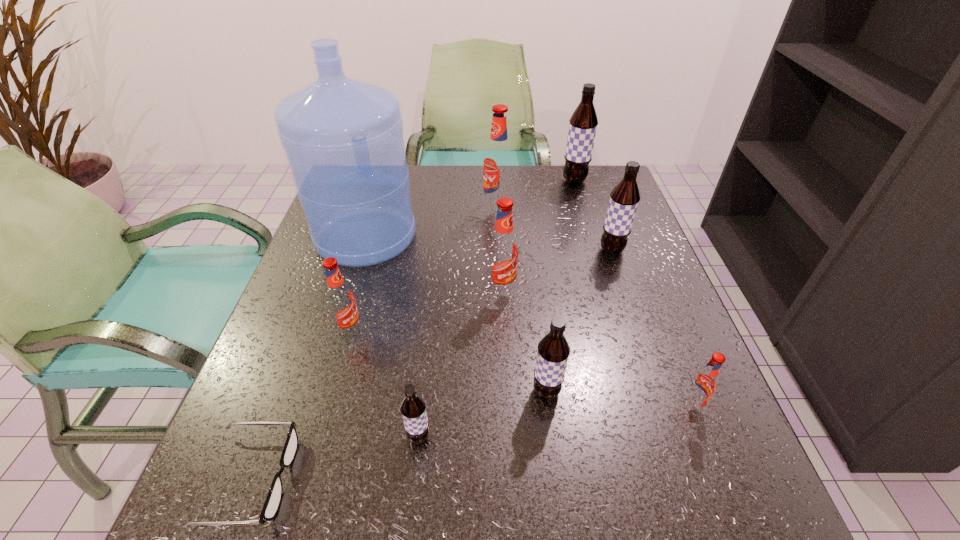
I want to click on free space located on the right of the nearest root beer, so click(x=638, y=437).

Locate an element on the screen. The image size is (960, 540). free space located on the front-facing side of the black spectacles is located at coordinates (378, 478).

Locate an element on the screen. The width and height of the screenshot is (960, 540). water jug situated at the far edge is located at coordinates (343, 138).

Locate an element on the screen. This screenshot has height=540, width=960. object situated at the near edge is located at coordinates (273, 500).

Where is `water jug that is at the left edge`? water jug that is at the left edge is located at coordinates (343, 138).

Identify the location of root beer that is at the left edge. (340, 299).

Locate an element on the screen. This screenshot has height=540, width=960. spectacles at the left edge is located at coordinates (273, 500).

Where is `object present at the far left corner`? object present at the far left corner is located at coordinates (343, 138).

Where is `object that is at the near left corner`? object that is at the near left corner is located at coordinates (273, 500).

Where is `object that is at the far right corner`? The image size is (960, 540). object that is at the far right corner is located at coordinates (583, 123).